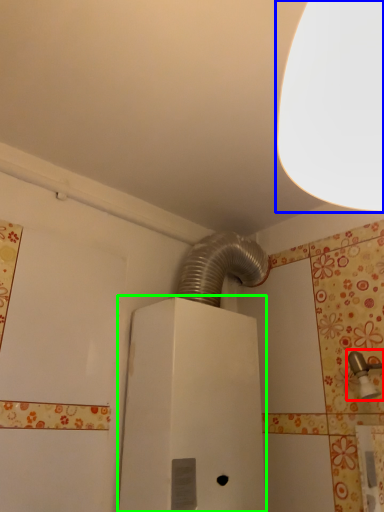
Question: Which is farther away from plumbing fixture (highlighted by a red box)? lamp (highlighted by a blue box) or water heater (highlighted by a green box)?

Choices:
 (A) lamp
 (B) water heater

Answer: (A)